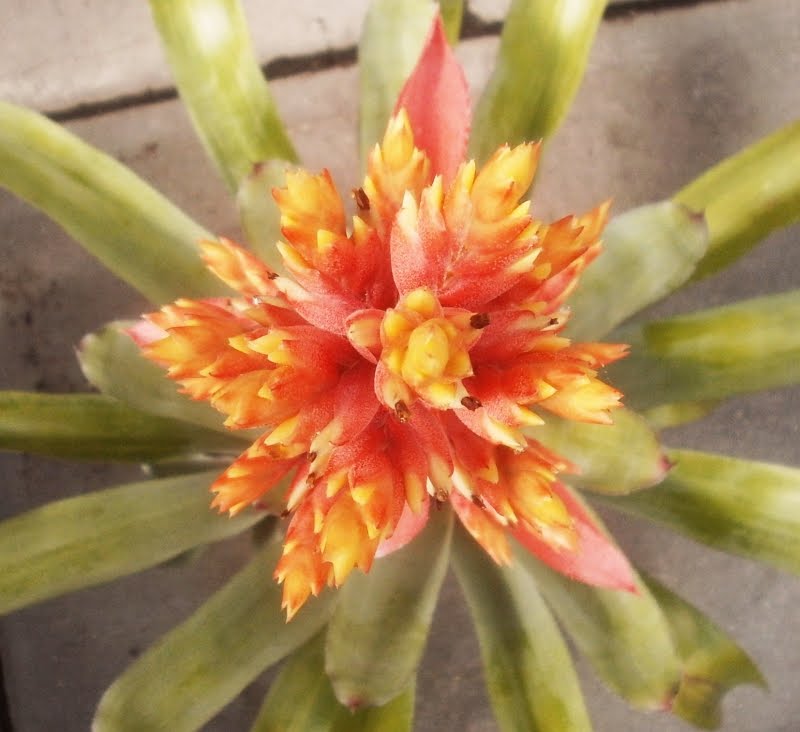
I want to click on concrete floor, so click(x=146, y=149), click(x=48, y=334), click(x=88, y=643), click(x=38, y=471), click(x=705, y=561), click(x=768, y=441), click(x=769, y=265), click(x=660, y=83).